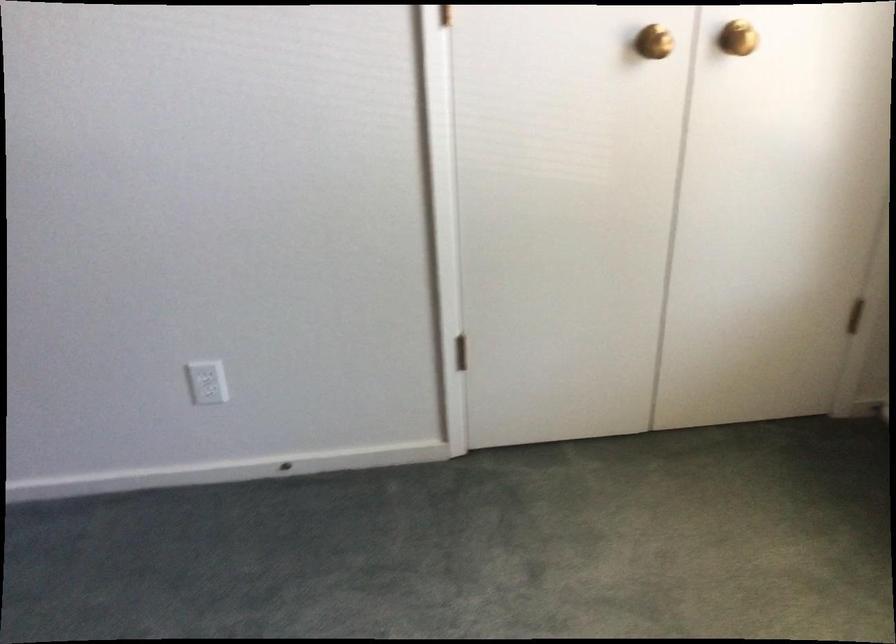
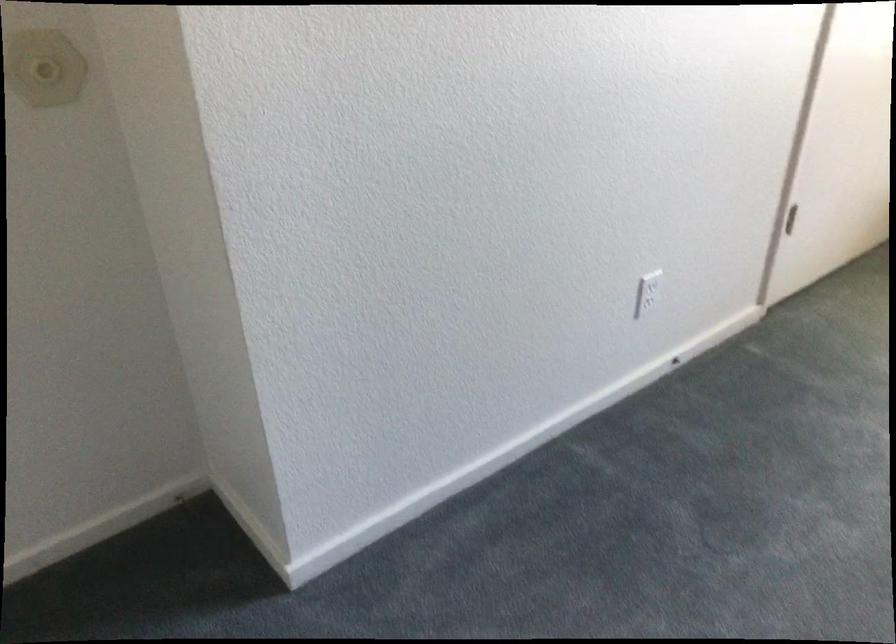
Locate, in the second image, the point that corresponds to point 213,393 in the first image.

(645, 303)